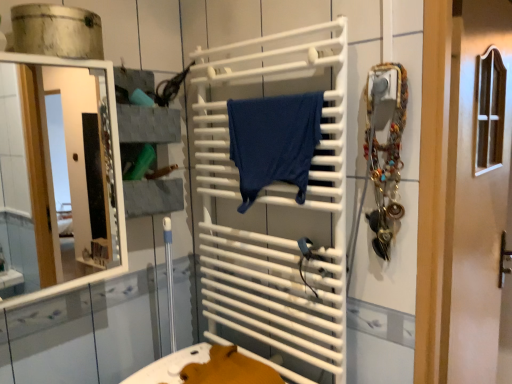
The height and width of the screenshot is (384, 512). Describe the element at coordinates (385, 149) in the screenshot. I see `metallic silver jewelry at right` at that location.

Locate an element on the screen. This screenshot has height=384, width=512. metallic silver jewelry at right is located at coordinates (385, 149).

From the picture: Measure the distance between white glossy door at center and camera.

white glossy door at center is 38.36 inches away from camera.

Identify the location of metallic silver jewelry at right. (385, 149).

Is white glossy mirror at left positioned behind white matte towel rack at center?

No.

Looking at this image, could you tell me if white glossy mirror at left is facing white matte towel rack at center?

No, white glossy mirror at left is not facing towards white matte towel rack at center.

Which of these two, white glossy mirror at left or white matte towel rack at center, is wider?

Wider between the two is white glossy mirror at left.

From the image's perspective, would you say white glossy mirror at left is positioned over white matte towel rack at center?

Yes, from the image's perspective, white glossy mirror at left is over white matte towel rack at center.

From the image's perspective, would you say white matte towel rack at center is shown under metallic silver jewelry at right?

Yes.

Does point (205, 234) lie in front of point (399, 148)?

No, it is behind (399, 148).

Would you consider white matte towel rack at center to be distant from metallic silver jewelry at right?

They are positioned close to each other.

Is white matte towel rack at center positioned beyond the bounds of metallic silver jewelry at right?

That's correct, white matte towel rack at center is outside of metallic silver jewelry at right.

Does point (374, 158) lie in front of point (322, 172)?

Yes.

Are metallic silver jewelry at right and white matte towel rack at center far apart?

metallic silver jewelry at right is actually quite close to white matte towel rack at center.

From the picture: From a real-world perspective, between metallic silver jewelry at right and white matte towel rack at center, who is vertically lower?

white matte towel rack at center is physically lower.

Is metallic silver jewelry at right outside of white matte towel rack at center?

Yes.

From the image's perspective, is white glossy mirror at left below metallic silver jewelry at right?

Yes.

Based on the photo, which object is closer to the camera, white glossy mirror at left or metallic silver jewelry at right?

white glossy mirror at left is in front.

Would you say white glossy mirror at left is a long distance from metallic silver jewelry at right?

Yes, white glossy mirror at left and metallic silver jewelry at right are quite far apart.

You are a GUI agent. You are given a task and a screenshot of the screen. Output one action in this format:
    pyautogui.click(x=<x>, y=<y>)
    Task: Click on the mirror that appears below the metallic silver jewelry at right (from a real-world perspective)
    This screenshot has height=384, width=512.
    Given the screenshot: What is the action you would take?
    pyautogui.click(x=68, y=169)

Between white matte towel rack at center and dark blue fabric at center, which one has less height?

dark blue fabric at center is shorter.

Between point (293, 300) and point (240, 151), which one is positioned in front?

The point (293, 300) is in front.

Can you confirm if white matte towel rack at center is positioned to the left of dark blue fabric at center?

Indeed, white matte towel rack at center is positioned on the left side of dark blue fabric at center.

Considering the positions of objects white matte towel rack at center and white glossy mirror at left in the image provided, who is more to the right, white matte towel rack at center or white glossy mirror at left?

white matte towel rack at center is more to the right.

Can you tell me how much white matte towel rack at center and white glossy mirror at left differ in facing direction?

white matte towel rack at center and white glossy mirror at left are facing 90.5 degrees away from each other.

Which object is thinner, white matte towel rack at center or white glossy mirror at left?

→ With smaller width is white matte towel rack at center.

Does white matte towel rack at center have a smaller size compared to white glossy mirror at left?

Yes.

In the scene shown: Is there a large distance between white glossy door at center and white glossy mirror at left?

Yes, white glossy door at center is far from white glossy mirror at left.

Identify the location of mirror above the white glossy door at center (from a real-world perspective). (68, 169).

Looking at this image, does white glossy door at center have a lesser width compared to white glossy mirror at left?

Correct, the width of white glossy door at center is less than that of white glossy mirror at left.

Is white glossy door at center in front of or behind white glossy mirror at left in the image?

Clearly, white glossy door at center is behind white glossy mirror at left.

In the image, there is a white glossy mirror at left. Where is `cage below it (from a real-world perspective)`? The image size is (512, 384). cage below it (from a real-world perspective) is located at coordinates coord(275,211).

In the image, there is a metallic silver jewelry at right. In order to click on cage below it (from the image's perspective) in this screenshot , I will do [x=275, y=211].

Estimate the real-world distances between objects in this image. Which object is closer to white matte towel rack at center, dark blue fabric at center or metallic silver jewelry at right?

dark blue fabric at center is closer to white matte towel rack at center.

Estimate the real-world distances between objects in this image. Which object is further from dark blue fabric at center, white glossy mirror at left or white matte towel rack at center?

white glossy mirror at left.

Based on their spatial positions, is white glossy door at center or white glossy mirror at left closer to metallic silver jewelry at right?

white glossy door at center lies closer to metallic silver jewelry at right than the other object.

Based on their spatial positions, is metallic silver jewelry at right or dark blue fabric at center further from white matte towel rack at center?

metallic silver jewelry at right is positioned further to the anchor white matte towel rack at center.

Which object lies further to the anchor point white matte towel rack at center, dark blue fabric at center or white glossy mirror at left?

Among the two, white glossy mirror at left is located further to white matte towel rack at center.

When comparing their distances from dark blue fabric at center, does metallic silver jewelry at right or white glossy mirror at left seem closer?

Among the two, metallic silver jewelry at right is located nearer to dark blue fabric at center.

Based on their spatial positions, is dark blue fabric at center or white glossy door at center closer to white matte towel rack at center?

dark blue fabric at center lies closer to white matte towel rack at center than the other object.

Looking at the image, which one is located closer to white matte towel rack at center, white glossy door at center or dark blue fabric at center?

Among the two, dark blue fabric at center is located nearer to white matte towel rack at center.

You are a GUI agent. You are given a task and a screenshot of the screen. Output one action in this format:
    pyautogui.click(x=<x>, y=<y>)
    Task: Click on the accessory located between white glossy mirror at left and white glossy door at center in the left-right direction
    The width and height of the screenshot is (512, 384).
    Given the screenshot: What is the action you would take?
    pyautogui.click(x=385, y=149)

What are the coordinates of `bath towel located between white glossy mirror at left and metallic silver jewelry at right in the left-right direction` in the screenshot? It's located at (274, 141).

Identify the location of bath towel between white matte towel rack at center and white glossy door at center. The width and height of the screenshot is (512, 384). (274, 141).

You are a GUI agent. You are given a task and a screenshot of the screen. Output one action in this format:
    pyautogui.click(x=<x>, y=<y>)
    Task: Click on the cage situated between white glossy mirror at left and white glossy door at center from left to right
    
    Given the screenshot: What is the action you would take?
    pyautogui.click(x=275, y=211)